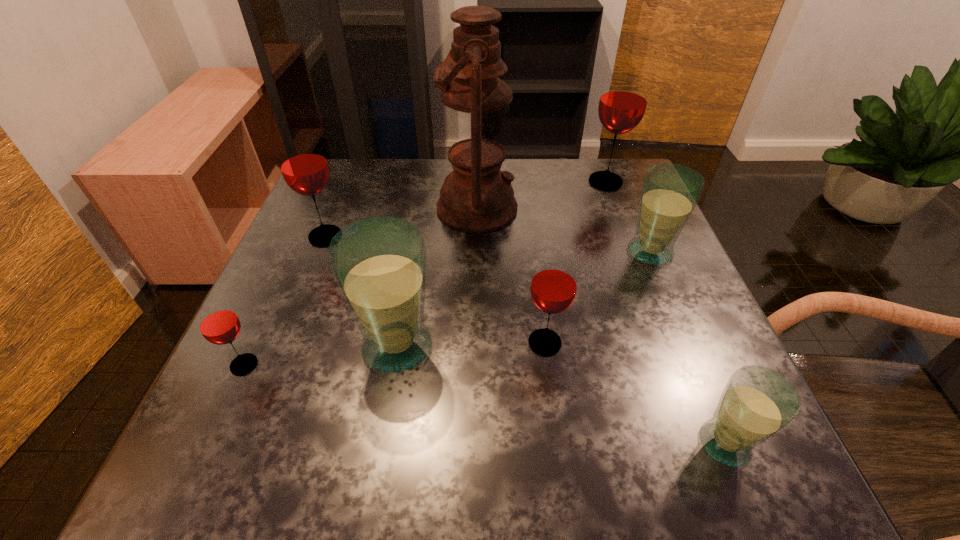
Identify the location of oil lamp that is at the far edge. The image size is (960, 540). (476, 196).

This screenshot has height=540, width=960. In order to click on glass located in the far edge section of the desktop in this screenshot , I will do `click(623, 101)`.

Locate an element on the screen. The height and width of the screenshot is (540, 960). object that is at the near edge is located at coordinates (757, 403).

The width and height of the screenshot is (960, 540). I want to click on object located in the far right corner section of the desktop, so [623, 101].

This screenshot has width=960, height=540. I want to click on object that is at the near right corner, so click(757, 403).

The height and width of the screenshot is (540, 960). In order to click on blank area at the far edge in this screenshot , I will do `click(535, 176)`.

What are the coordinates of `vacant area at the near edge` in the screenshot? It's located at (593, 460).

The width and height of the screenshot is (960, 540). I want to click on vacant space at the left edge of the desktop, so click(310, 276).

I want to click on free spot at the right edge of the desktop, so click(x=685, y=412).

Identify the location of free space at the near left corner of the desktop. (269, 429).